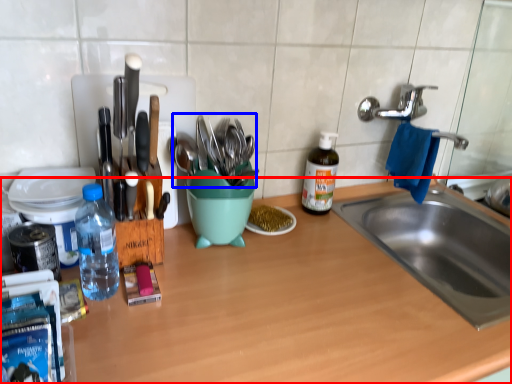
Question: Which point is closer to the camera, countertop (highlighted by a red box) or tableware (highlighted by a blue box)?

Choices:
 (A) countertop
 (B) tableware

Answer: (A)